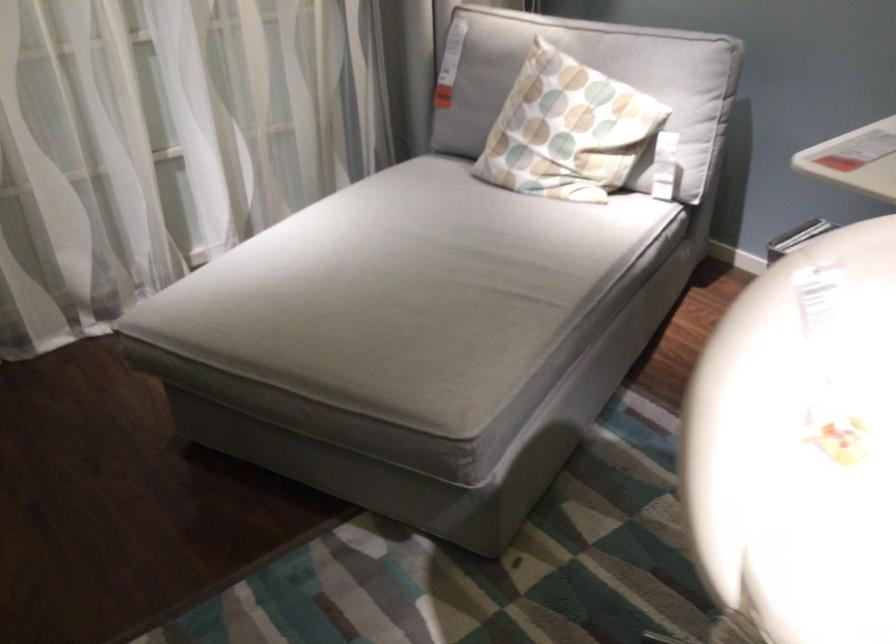
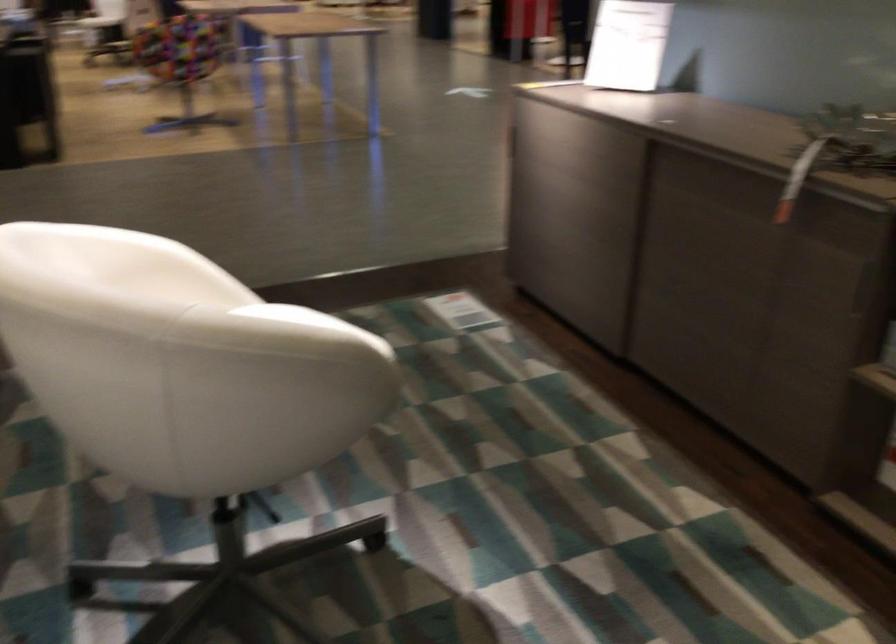
Find the pixel in the second image that matches [728,332] in the first image.

(307, 321)